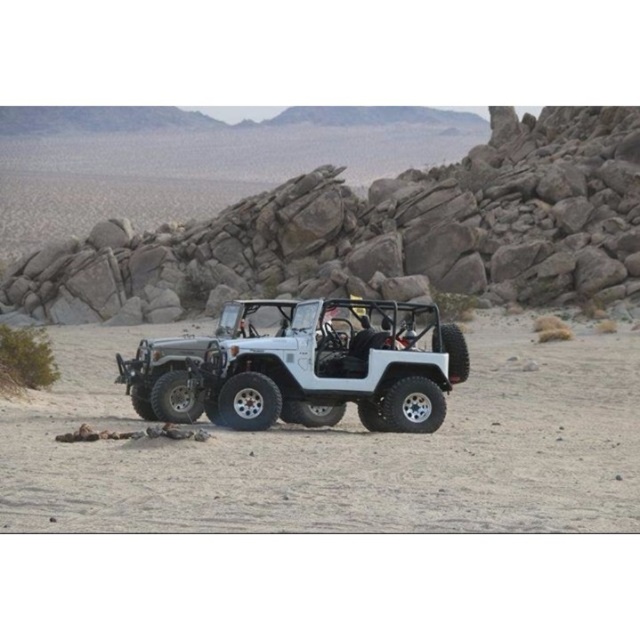
Question: Can you confirm if rockymaterial/textureformation at upper center is wider than white matte sand at center?

Choices:
 (A) no
 (B) yes

Answer: (B)

Question: Estimate the real-world distances between objects in this image. Which object is farther from the white matte sand at center?

Choices:
 (A) white matte jeep at center
 (B) rockymaterial/textureformation at upper center

Answer: (B)

Question: Can you confirm if rockymaterial/textureformation at upper center is wider than white matte jeep at center?

Choices:
 (A) yes
 (B) no

Answer: (A)

Question: Based on their relative distances, which object is nearer to the white matte jeep at center?

Choices:
 (A) rockymaterial/textureformation at upper center
 (B) white matte sand at center

Answer: (B)

Question: Which point is closer to the camera?

Choices:
 (A) white matte sand at center
 (B) rockymaterial/textureformation at upper center
 (C) white matte jeep at center

Answer: (A)

Question: Can you confirm if white matte sand at center is thinner than white matte jeep at center?

Choices:
 (A) yes
 (B) no

Answer: (B)